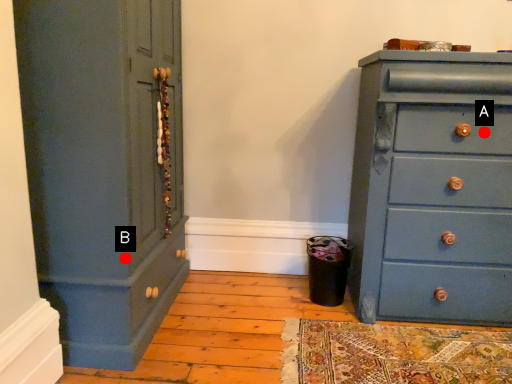
Question: Two points are circled on the image, labeled by A and B beside each circle. Which point is farther from the camera taking this photo?

Choices:
 (A) A is further
 (B) B is further

Answer: (A)